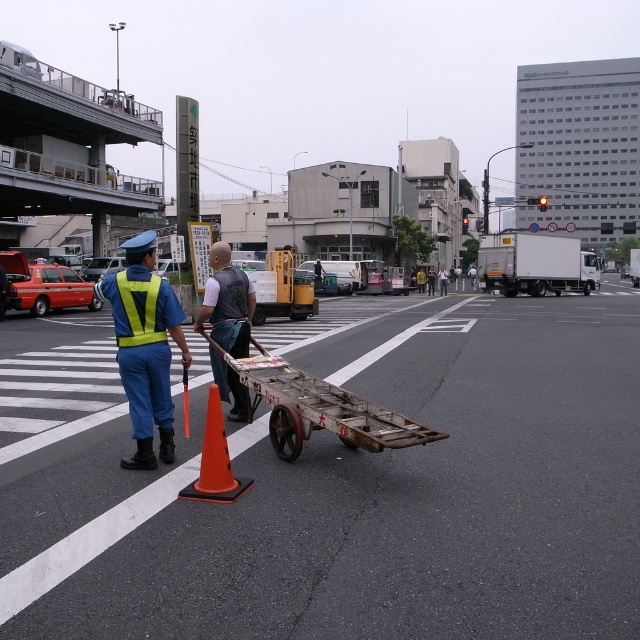
Question: Does gray fabric shirt at center appear on the right side of high-visibility fabric safety vest at left?

Choices:
 (A) yes
 (B) no

Answer: (B)

Question: In this image, where is rusty metal cart at center located relative to gray fabric shirt at center?

Choices:
 (A) above
 (B) below

Answer: (B)

Question: Based on their relative distances, which object is nearer to the reflective yellow vest at center?

Choices:
 (A) high-visibility fabric safety vest at left
 (B) orange matte traffic cone at lower center

Answer: (B)

Question: Which object appears farthest from the camera in this image?

Choices:
 (A) reflective yellow vest at center
 (B) gray fabric shirt at center

Answer: (B)

Question: Does gray fabric shirt at center appear on the right side of orange matte traffic cone at lower center?

Choices:
 (A) no
 (B) yes

Answer: (A)

Question: Based on their relative distances, which object is nearer to the reflective yellow vest at center?

Choices:
 (A) gray fabric shirt at center
 (B) rusty metal cart at center
 (C) orange matte traffic cone at lower center
 (D) high-visibility fabric safety vest at left

Answer: (B)